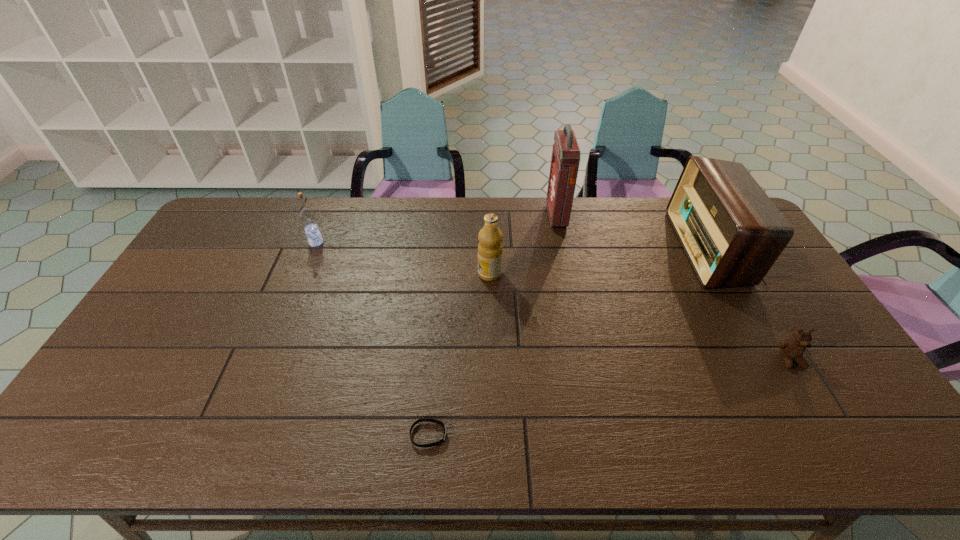
In order to click on free space at the left edge of the desktop in this screenshot , I will do `click(234, 258)`.

Image resolution: width=960 pixels, height=540 pixels. Identify the location of vacant space at the right edge. (816, 385).

Find the location of `vacant space that is in between the radio receiver and the fifth farthest object`. vacant space that is in between the radio receiver and the fifth farthest object is located at coordinates (750, 303).

Identify the location of unoccupied position between the radio receiver and the leftmost object. (513, 245).

The width and height of the screenshot is (960, 540). What are the coordinates of `free point between the olive oil and the third object from right to left` in the screenshot? It's located at (523, 245).

Where is `free point between the radio receiver and the vodka`? This screenshot has height=540, width=960. free point between the radio receiver and the vodka is located at coordinates (513, 245).

In order to click on vacant area between the radio receiver and the vodka in this screenshot , I will do (513, 245).

I want to click on vacant region between the teddy bear and the tallest object, so click(673, 288).

Find the location of a particular element. free space that is in between the radio receiver and the shortest object is located at coordinates (568, 341).

This screenshot has height=540, width=960. What are the coordinates of `free area in between the nearest object and the fifth tallest object` in the screenshot? It's located at (610, 397).